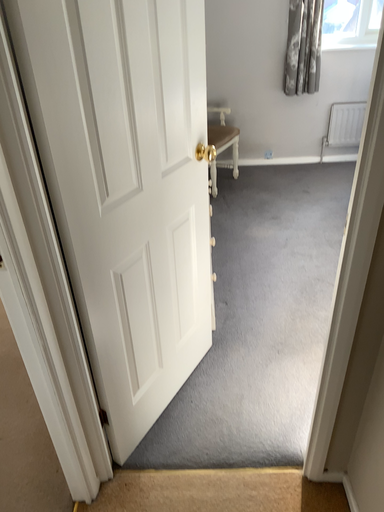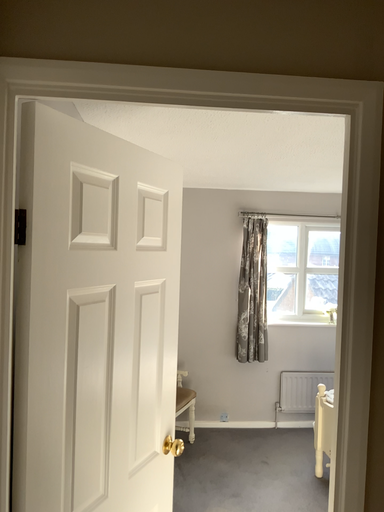
Question: How did the camera likely rotate when shooting the video?

Choices:
 (A) rotated downward
 (B) rotated upward

Answer: (B)